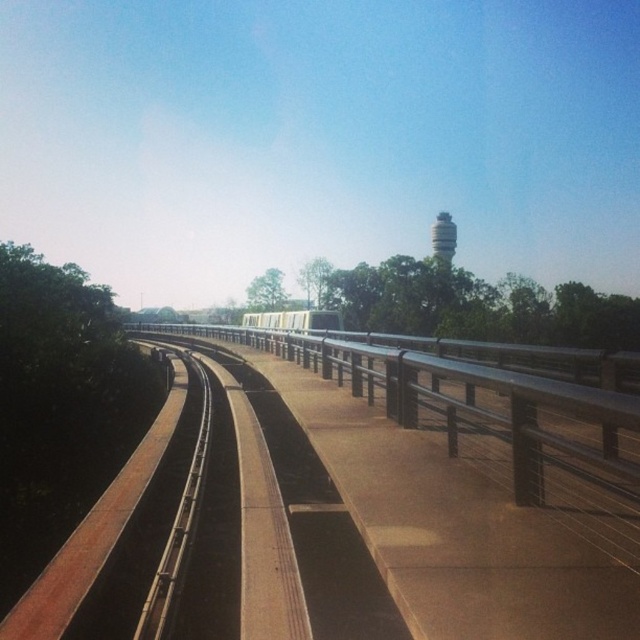
You are a commuter waiting at the train station. You notice the metallic silver train at center and the white matte water tower at upper center. Which object takes up more area in the scene?

The white matte water tower at upper center occupies more space than the metallic silver train at center.

You are a passenger waiting at the train station. You see the metallic silver train at center and the white matte water tower at upper center. Which object is closer to the sky?

The white matte water tower at upper center is closer to the sky because it is positioned above the metallic silver train at center.

You are standing on the platform at the train station. There is a point at coordinates [294,320]. What object is located at that point?

The point at coordinates [294,320] corresponds to the metallic silver train at center.